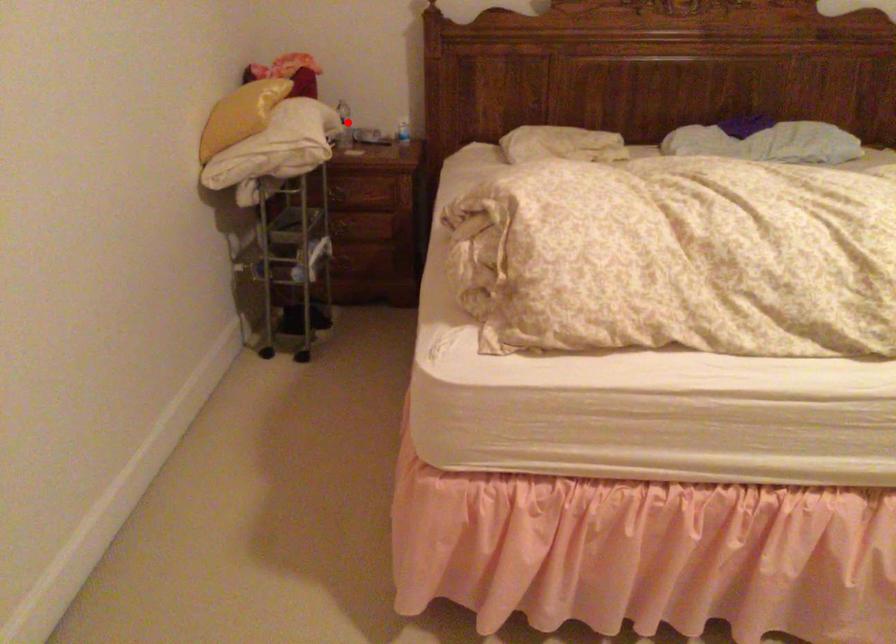
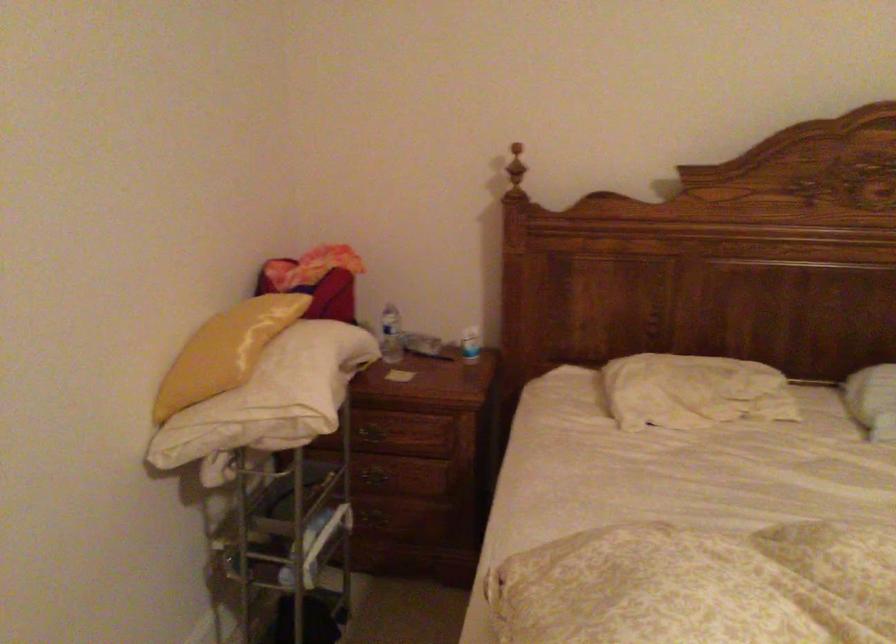
Question: I am providing you with two images of the same scene from different viewpoints. Given a red point in image1, look at the same physical point in image2. Is it:

Choices:
 (A) Closer to the viewpoint
 (B) Farther from the viewpoint

Answer: (A)